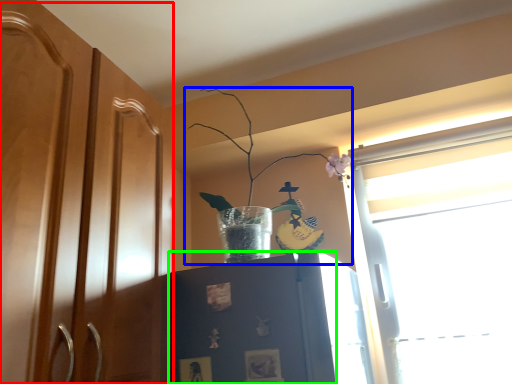
Question: Based on their relative distances, which object is nearer to dresser (highlighted by a red box)? Choose from houseplant (highlighted by a blue box) and cabinetry (highlighted by a green box).

Choices:
 (A) houseplant
 (B) cabinetry

Answer: (B)